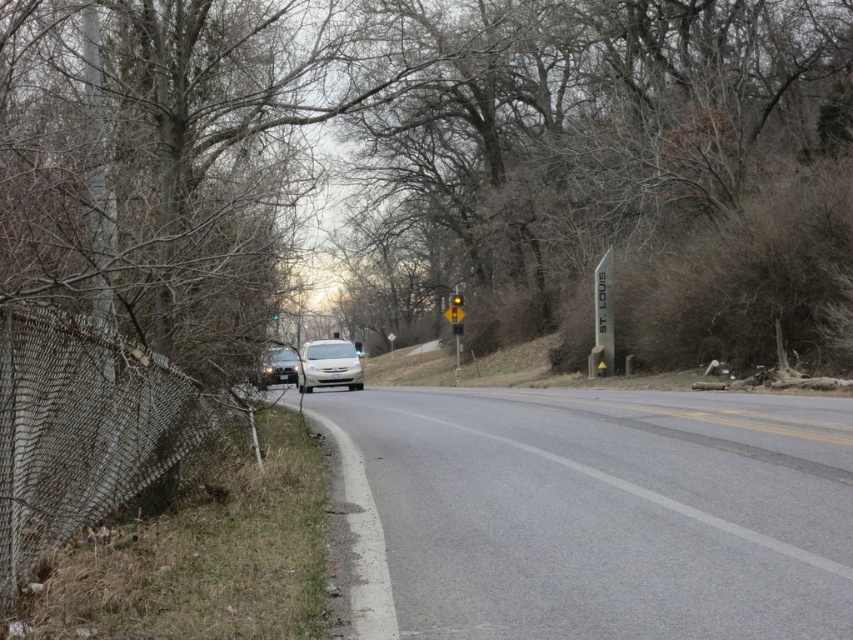
You are standing at point A located at coordinates point A at (x=607, y=364). You want to walk to point B, which is 34.32 meters away. Is there any obstacle between you and point B along the road?

There are no obstacles between point A at (x=607, y=364) and point B since the road is a two lane asphalt and the scene description mentions no obstructions. The path is clear.

You are standing on the rural road depicted in the scene. You notice a point marked at coordinates (438, 168). Based on the scene description, what object does this point most likely represent?

The point at (438, 168) corresponds to the brown leafless tree at left.

You are driving on the rural road and see the brown leafless tree at left and the yellow plastic traffic light at center. Which object is closer to you as you drive along the road?

The brown leafless tree at left is closer to you because it is in front of the yellow plastic traffic light at center, indicating it is positioned nearer along your line of sight.